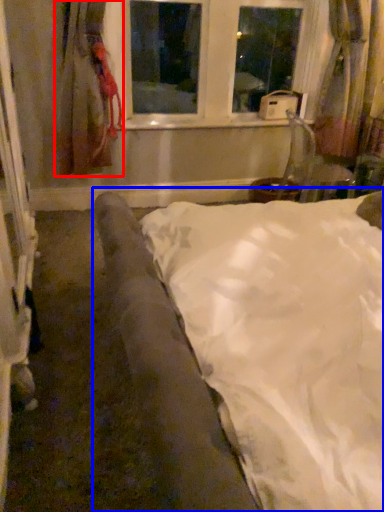
Question: Among these objects, which one is nearest to the camera, curtain (highlighted by a red box) or bed (highlighted by a blue box)?

Choices:
 (A) curtain
 (B) bed

Answer: (B)